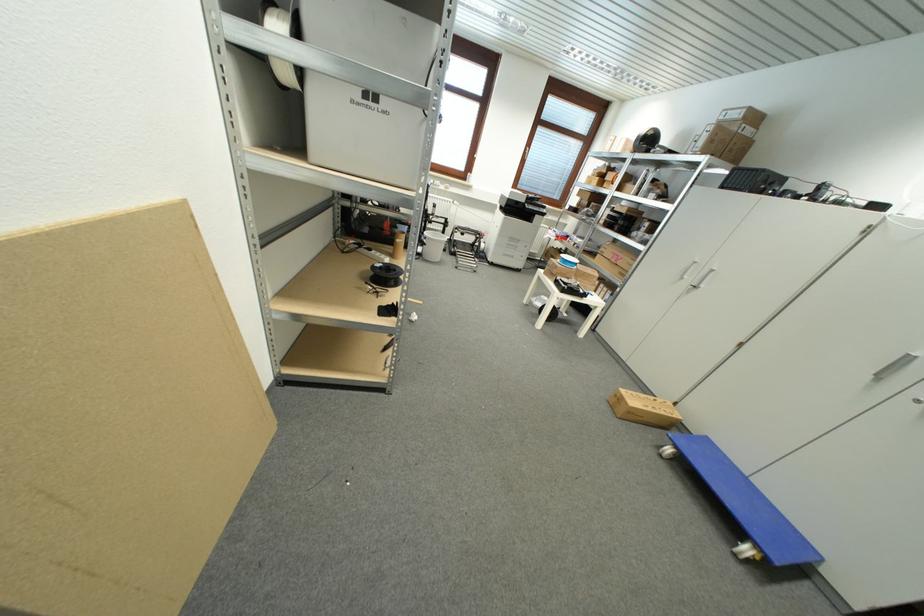
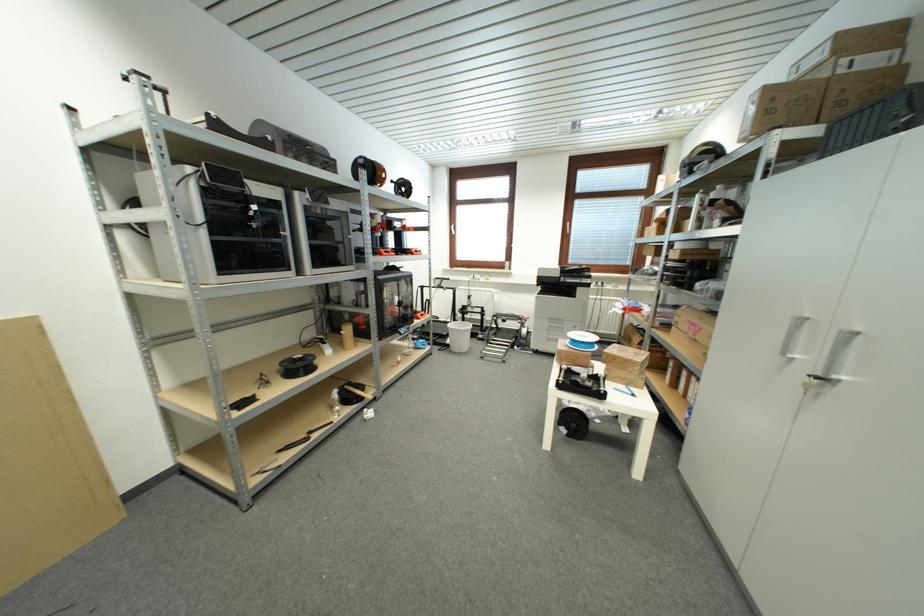
The point at (736,153) is marked in the first image. Where is the corresponding point in the second image?

(845, 106)